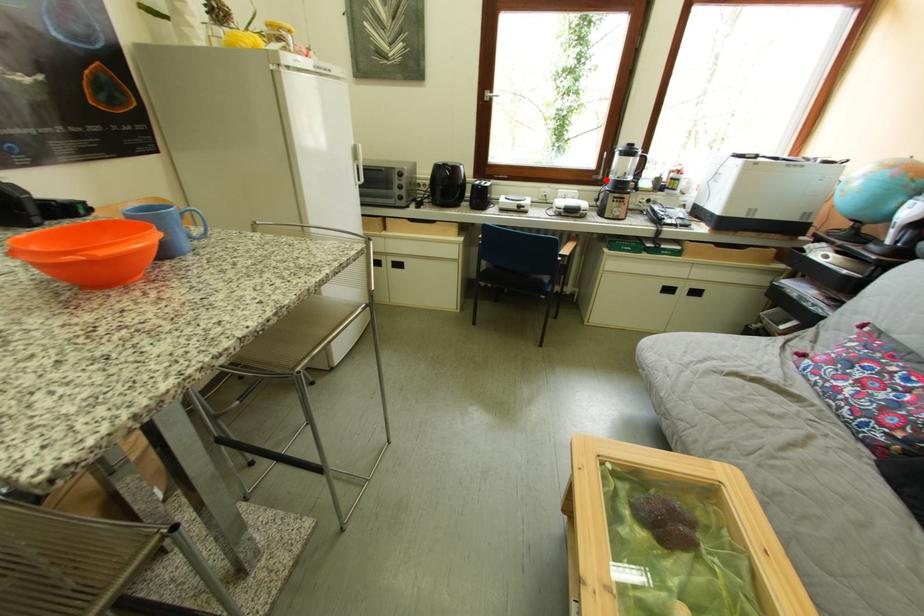
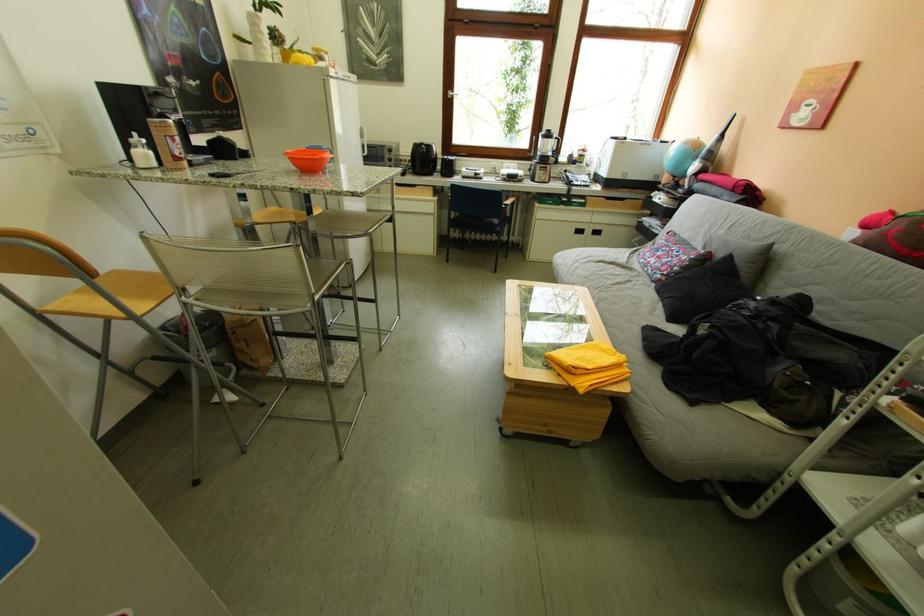
Question: I am providing you with two images of the same scene from different viewpoints. A red point is shown in image1. For the corresponding object point in image2, is it positioned nearer or farther from the camera?

Choices:
 (A) Nearer
 (B) Farther

Answer: (A)